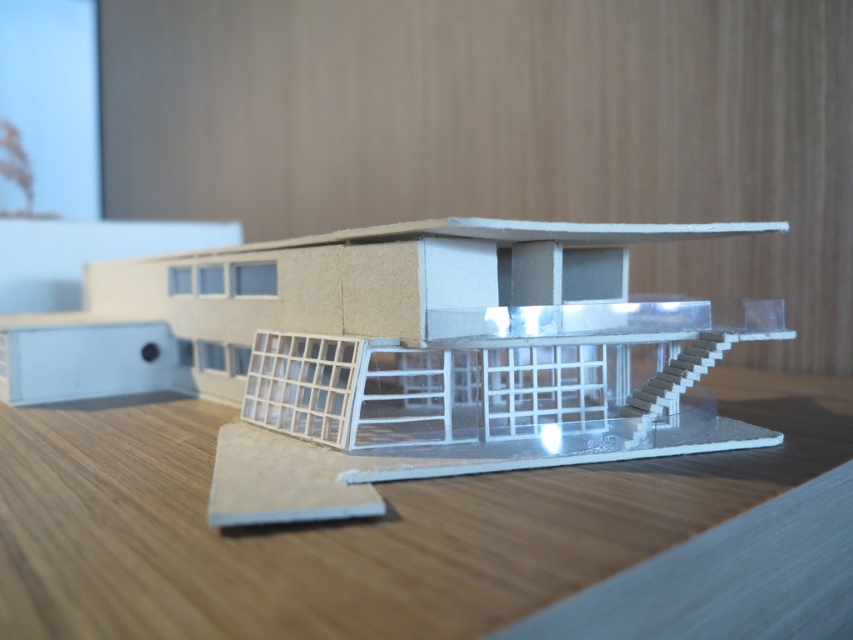
Question: Is transparent plastic house at center to the right of wooden table at center from the viewer's perspective?

Choices:
 (A) no
 (B) yes

Answer: (A)

Question: Can you confirm if transparent plastic house at center is wider than wooden table at center?

Choices:
 (A) no
 (B) yes

Answer: (A)

Question: Which of the following is the closest to the observer?

Choices:
 (A) wooden table at center
 (B) transparent plastic house at center

Answer: (A)

Question: Does transparent plastic house at center appear on the left side of wooden table at center?

Choices:
 (A) no
 (B) yes

Answer: (B)

Question: Which point is closer to the camera taking this photo?

Choices:
 (A) (479, 365)
 (B) (30, 424)

Answer: (A)